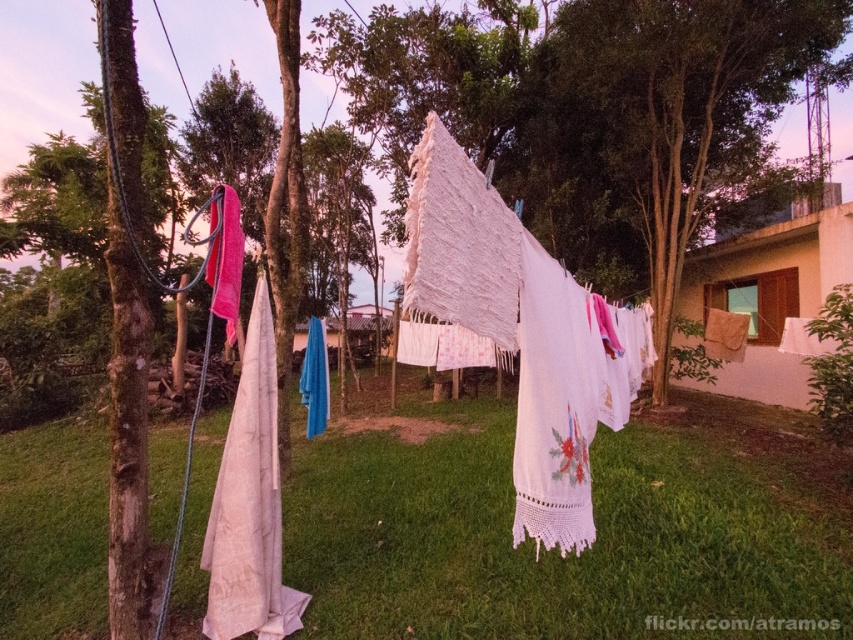
You are standing at the edge of the grassy area in the scene. If you walk straight towards the center of the image, will you step onto the green grass at center?

Yes, walking straight towards the center of the image will lead you to the green grass at center located at point coordinates (555,552).

You are standing at the center of the grassy area in the foreground of the scene. There are two points marked on the clothesline between the trees. One is at coordinates point (550,355) and the other at point (265,486). Which point is closer to you?

Point (550,355) is in front of point (265,486), so the point at (550,355) is closer to you.

You are standing in the outdoor area where clothes are drying on a line between two trees. You notice two points marked on the clothesline. The first point is at coordinates point [207,426] and the second point is at point [248,403]. Which point is closer to you?

Point [207,426] is further to the camera than point [248,403], so the second point is closer to you.